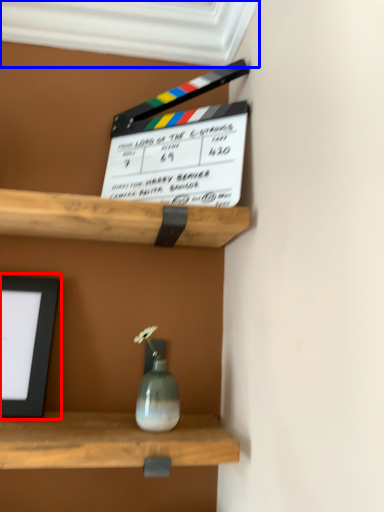
Question: Among these objects, which one is farthest to the camera, picture frame (highlighted by a red box) or window frame (highlighted by a blue box)?

Choices:
 (A) picture frame
 (B) window frame

Answer: (A)